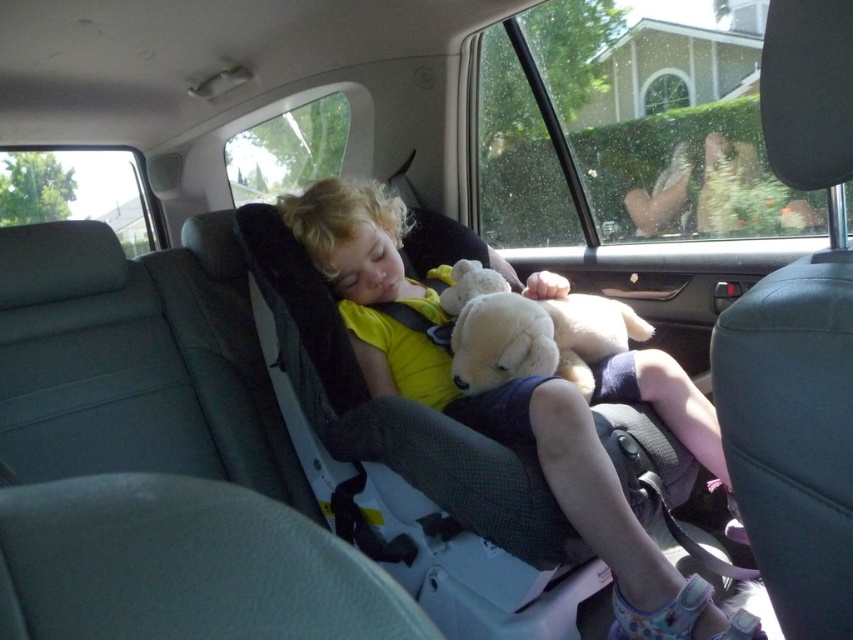
Which of these two, yellow fabric child at center or white plush teddy bear at center, stands taller?

With more height is yellow fabric child at center.

The width and height of the screenshot is (853, 640). What do you see at coordinates (495, 406) in the screenshot?
I see `yellow fabric child at center` at bounding box center [495, 406].

The width and height of the screenshot is (853, 640). What are the coordinates of `yellow fabric child at center` in the screenshot? It's located at (495, 406).